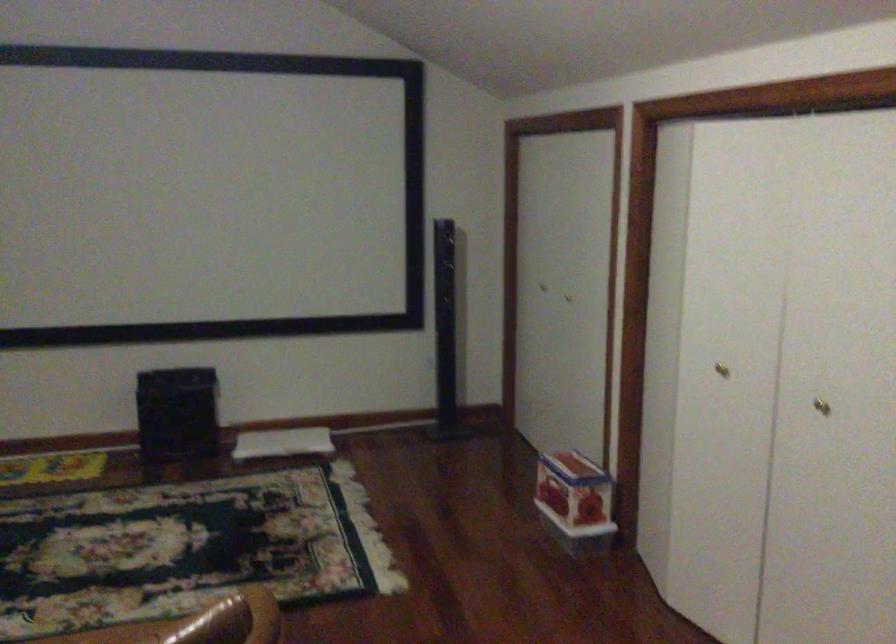
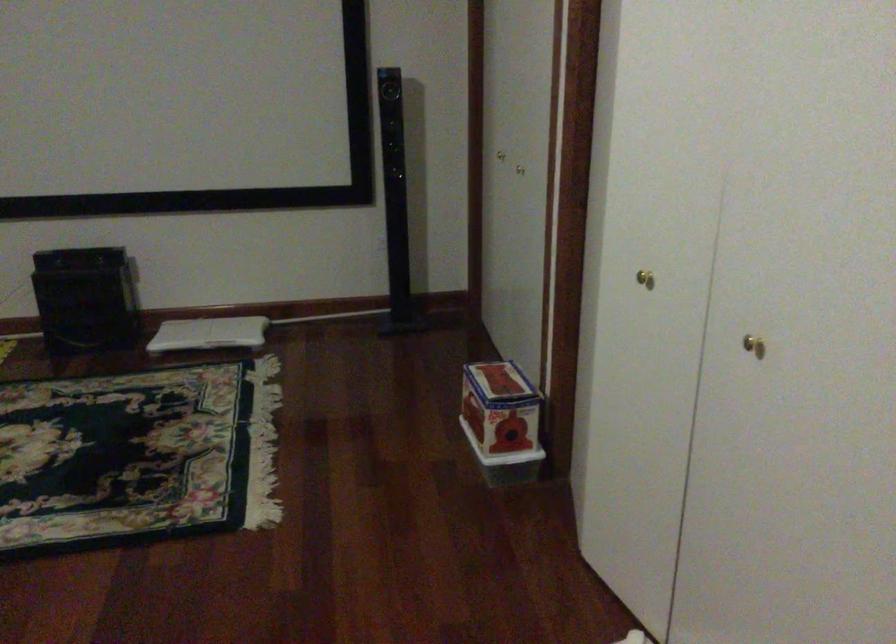
Question: Based on the continuous images, in which direction is the camera rotating? Reply with the corresponding letter.

Choices:
 (A) Left
 (B) Right
 (C) Up
 (D) Down

Answer: (D)